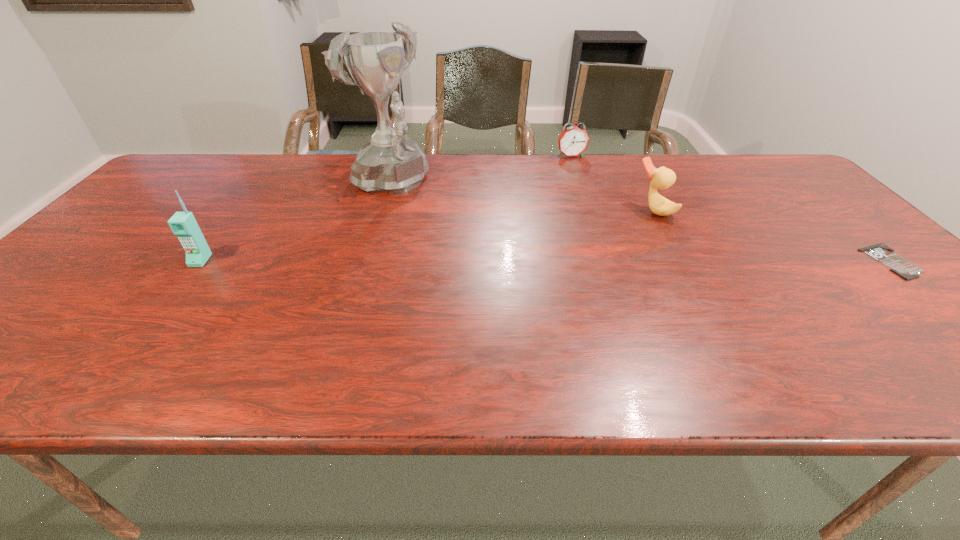
Where is `cellular telephone`? The width and height of the screenshot is (960, 540). cellular telephone is located at coordinates (183, 224).

Image resolution: width=960 pixels, height=540 pixels. I want to click on the leftmost object, so click(x=183, y=224).

At what (x,y) coordinates should I click in order to perform the action: click on identity card. Please return your answer as a coordinate pair (x, y). The height and width of the screenshot is (540, 960). Looking at the image, I should click on (904, 268).

You are a GUI agent. You are given a task and a screenshot of the screen. Output one action in this format:
    pyautogui.click(x=<x>, y=<y>)
    Task: Click on the shortest object
    
    Given the screenshot: What is the action you would take?
    904,268

Identify the location of alarm clock. Image resolution: width=960 pixels, height=540 pixels. (573, 141).

Identify the location of the third object from left to right. The width and height of the screenshot is (960, 540). (573, 141).

Find the location of a particular element. This screenshot has width=960, height=540. the fourth object from right to left is located at coordinates (391, 162).

I want to click on the tallest object, so click(x=391, y=162).

Image resolution: width=960 pixels, height=540 pixels. Find the location of `the second object from right to left`. the second object from right to left is located at coordinates (662, 178).

The width and height of the screenshot is (960, 540). I want to click on vacant space located 0.150m on the keypad of the leftmost object, so click(x=161, y=313).